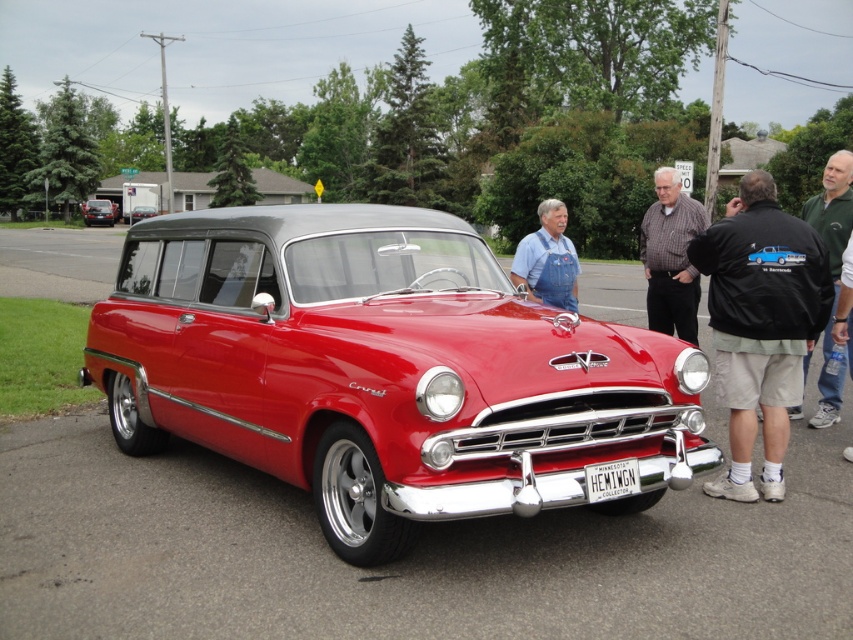
Question: Is black jacket at lower right closer to camera compared to green cotton shirt at right?

Choices:
 (A) no
 (B) yes

Answer: (B)

Question: In this image, where is black jacket at lower right located relative to white metallic license plate at center?

Choices:
 (A) below
 (B) above

Answer: (B)

Question: Which point is farther to the camera?

Choices:
 (A) (683, 241)
 (B) (102, 214)
 (C) (741, 497)

Answer: (B)

Question: Is black jacket at lower right wider than shiny black car at center?

Choices:
 (A) yes
 (B) no

Answer: (A)

Question: Among these points, which one is nearest to the camera?

Choices:
 (A) (733, 205)
 (B) (828, 348)
 (C) (845, 339)
 (D) (693, 234)

Answer: (C)

Question: Which of the following is the closest to the observer?

Choices:
 (A) (849, 237)
 (B) (817, 209)
 (C) (694, 224)
 (D) (350, 488)

Answer: (D)